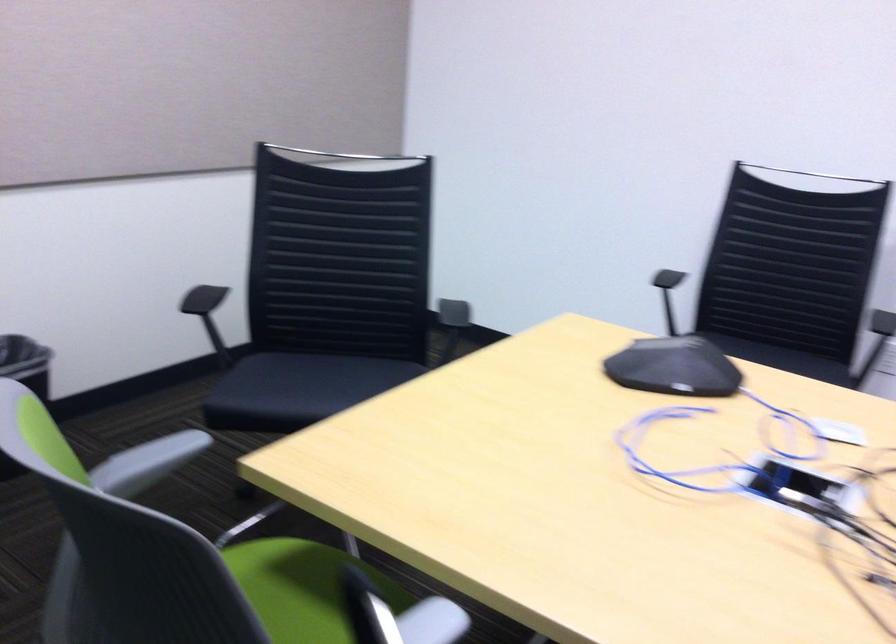
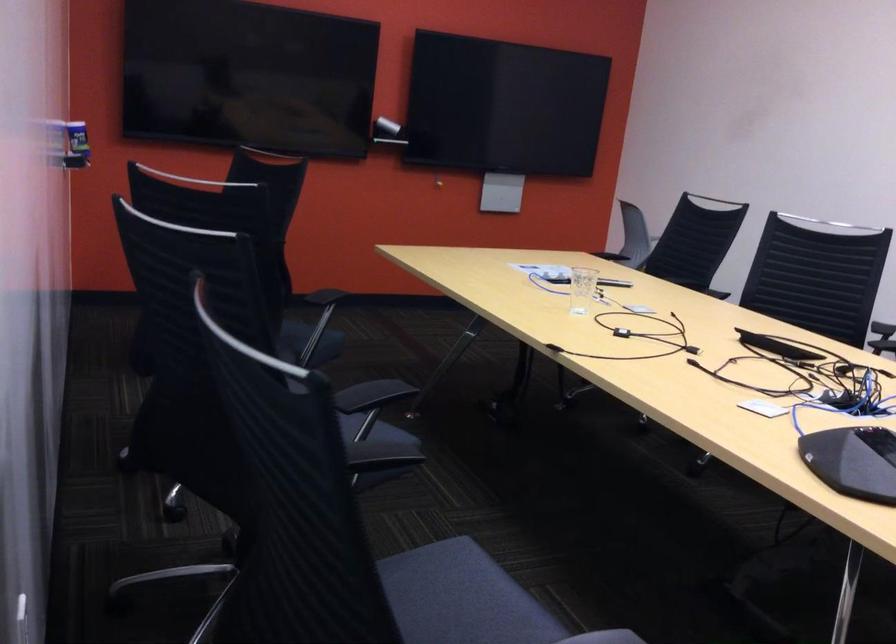
Where in the second image is the point corresponding to (781,360) from the first image?

(461, 598)